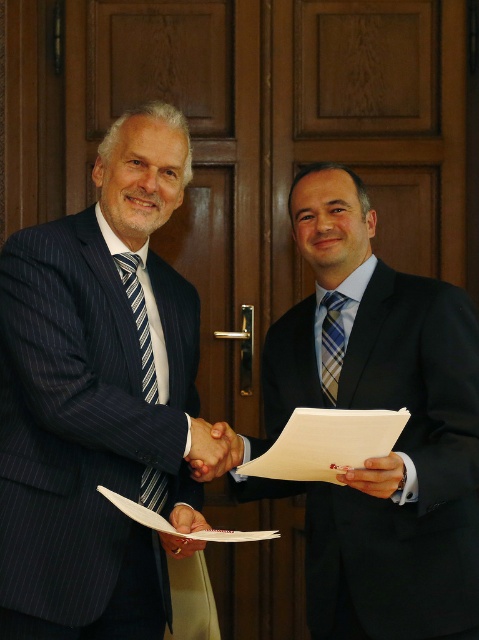
Can you confirm if matte black suit at center is positioned to the right of matte black hand at center?

Indeed, matte black suit at center is positioned on the right side of matte black hand at center.

Does matte black suit at center have a greater height compared to matte black hand at center?

Yes, matte black suit at center is taller than matte black hand at center.

Where is `matte black suit at center`? This screenshot has width=479, height=640. matte black suit at center is located at coordinates (397, 440).

Can you confirm if striped fabric tie at left is wider than smooth skin handshake at center?

No, striped fabric tie at left is not wider than smooth skin handshake at center.

Between striped fabric tie at left and smooth skin handshake at center, which one has less height?

smooth skin handshake at center

Who is more forward, (148,496) or (227,461)?

Positioned in front is point (148,496).

I want to click on striped fabric tie at left, so click(138, 321).

Does point (167, 144) lie behind point (395, 547)?

Yes, it is.

Who is positioned more to the right, blue pinstripe suit at center or matte black suit at center?

matte black suit at center is more to the right.

Between point (128, 609) and point (413, 593), which one is positioned behind?

Point (128, 609)

Where is `blue pinstripe suit at center`? The width and height of the screenshot is (479, 640). blue pinstripe suit at center is located at coordinates (97, 396).